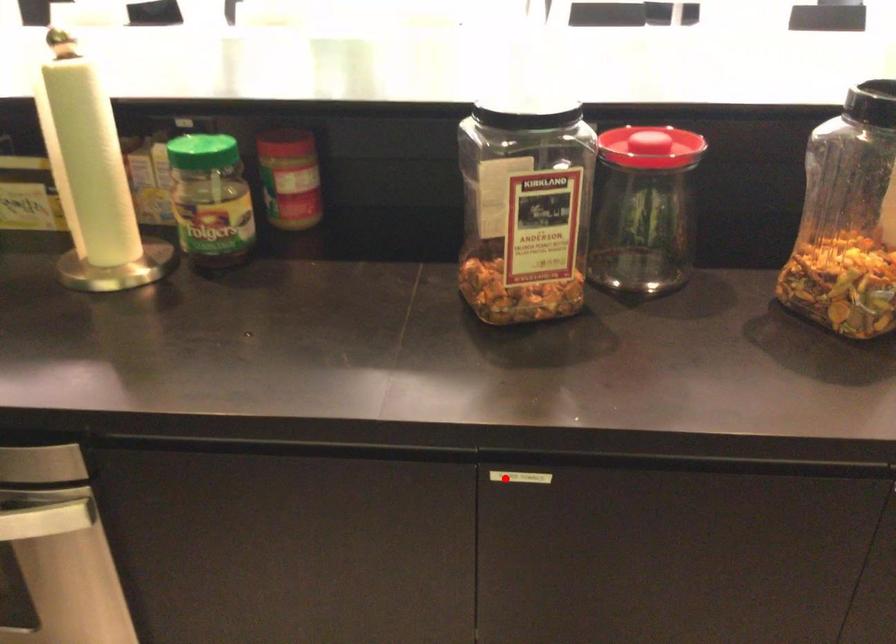
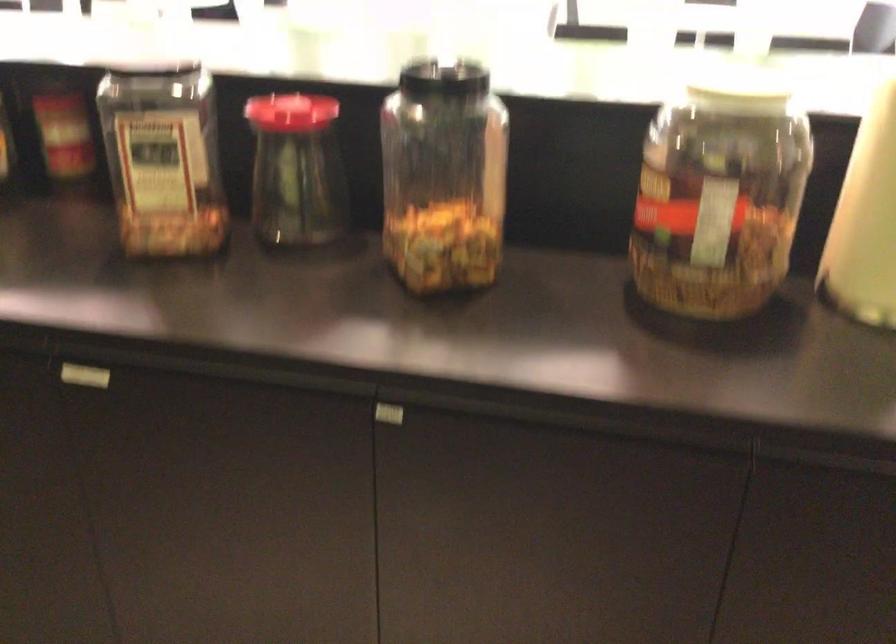
Locate, in the second image, the point that corresponds to the highlighted location in the first image.

(84, 375)